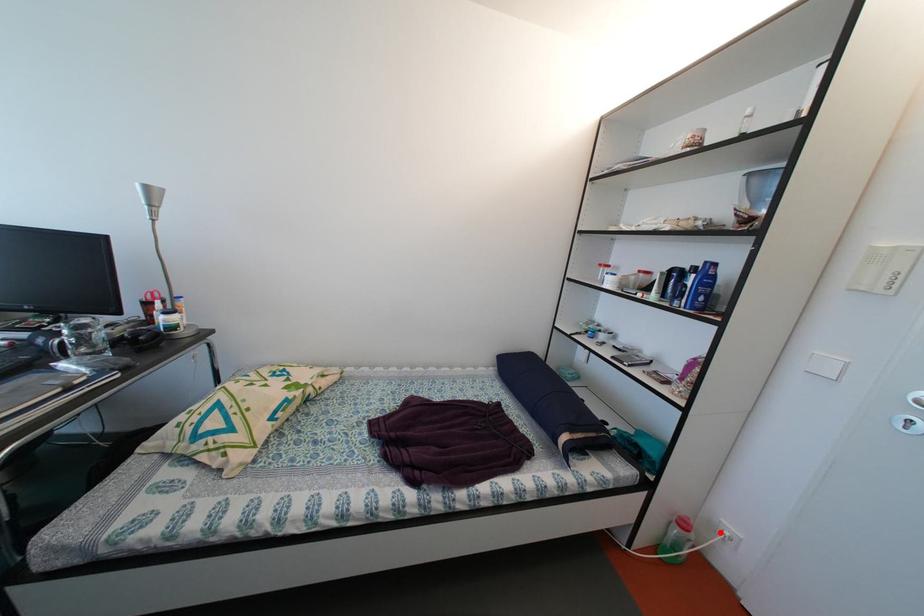
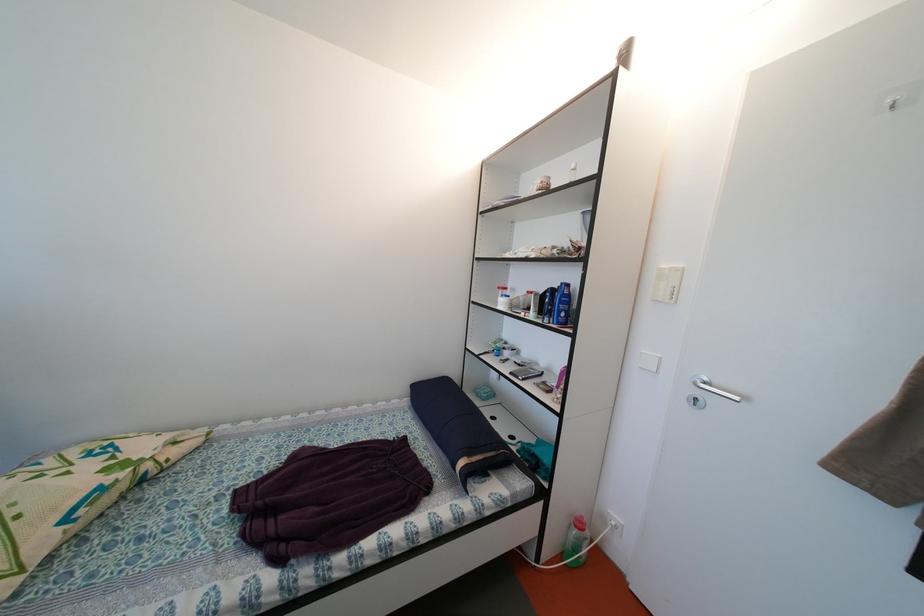
Question: I am providing you with two images of the same scene from different viewpoints. Given a red point in image1, look at the same physical point in image2. Is it:

Choices:
 (A) Closer to the viewpoint
 (B) Farther from the viewpoint

Answer: (A)